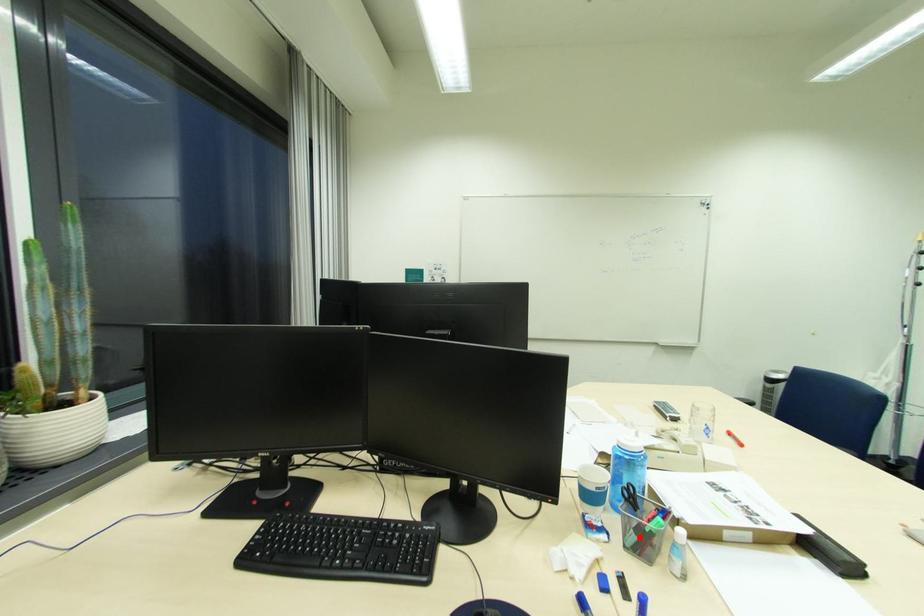
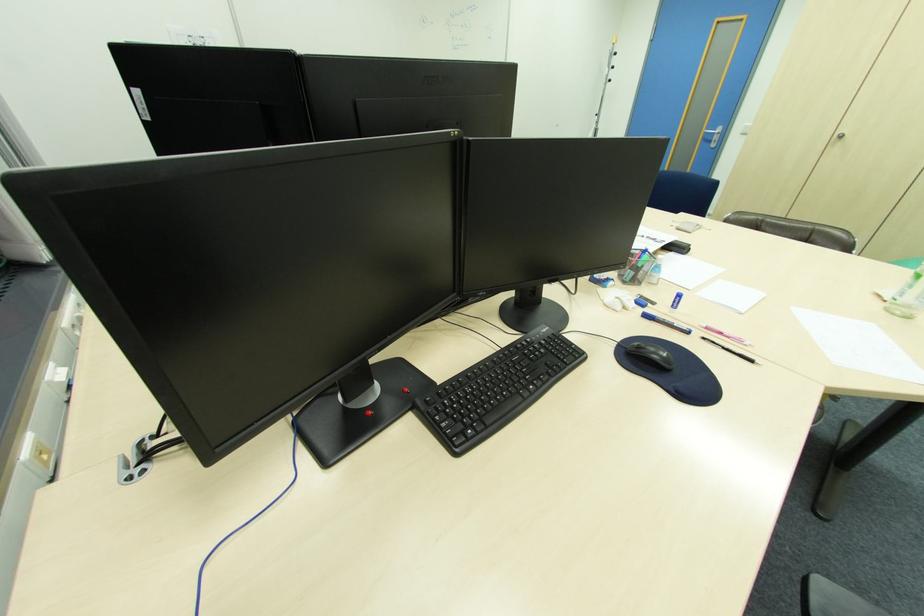
Locate, in the second image, the point that corresponds to the highlighted location in the first image.

(637, 274)